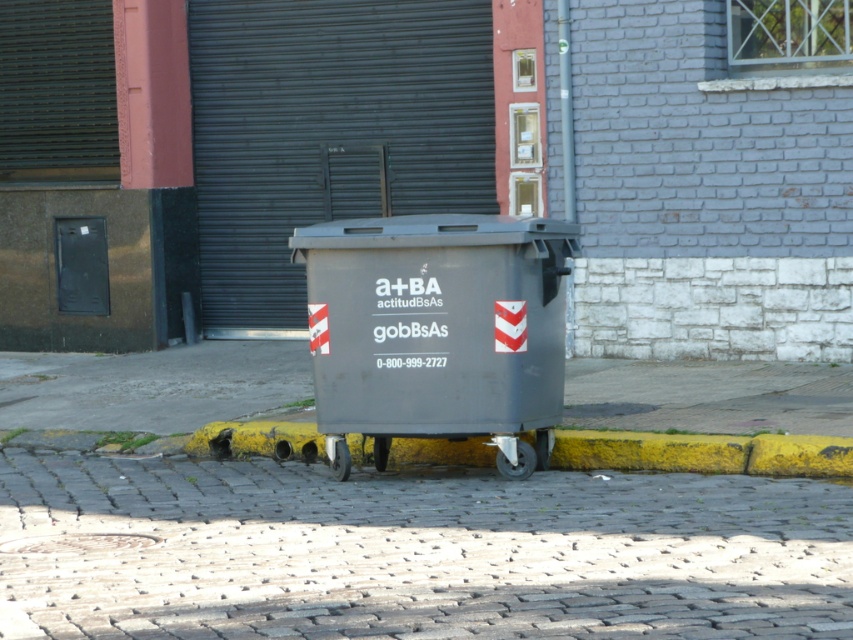
You are a delivery person trying to park your bike. You see the cobblestone pavement at center and the yellow painted curb at lower center. Which surface is better for parking your bike?

The cobblestone pavement at center is closer to the viewer than the yellow painted curb at lower center, so it is better to park the bike on the cobblestone pavement at center since it is nearer and more stable for parking.

You need to place a rectangular box that is 1 meter wide between the gray plastic recycling bin at center and the yellow painted curb at lower center. Based on their widths, will the box fit between them?

The gray plastic recycling bin at center is thinner than the yellow painted curb at lower center. However, the question is about fitting a box between them based on their widths. Since the bin is thinner, the space between them might be sufficient. But without knowing the exact distance between the two objects, we cannot determine if the 1 meter wide box will fit. The width of the objects themselves doesn

You are standing on the cobblestone pavement at center and want to place a package into the gray plastic recycling bin at center. Which direction should you move to get closer to the bin?

The gray plastic recycling bin at center is farther away from you than the cobblestone pavement at center. To get closer to the bin, you should move forward away from the cobblestone pavement at center towards the bin.